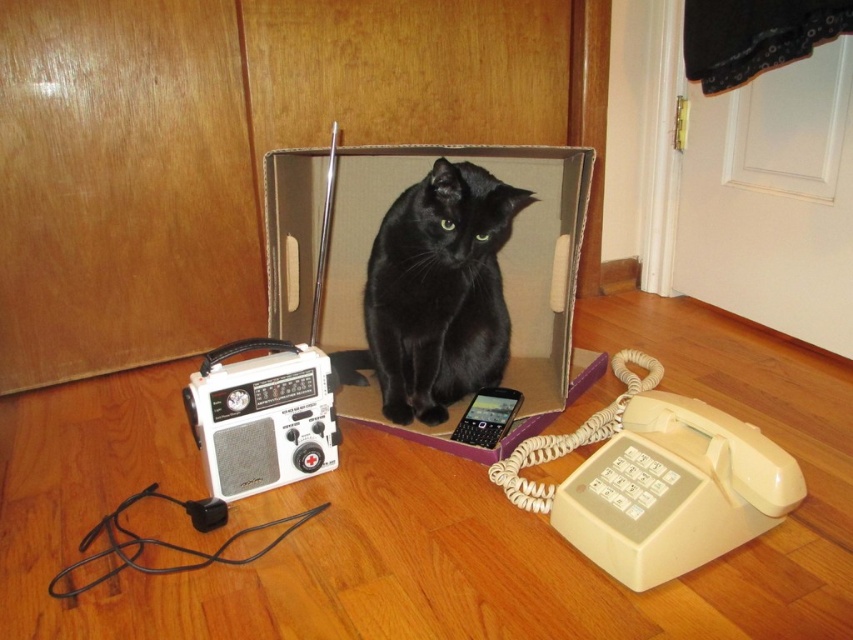
Does black glossy cat at center appear over black plastic phone at center?

Yes, black glossy cat at center is above black plastic phone at center.

Between black glossy cat at center and black plastic phone at center, which one is positioned higher?

black glossy cat at center is higher up.

Which is in front, point (374, 300) or point (479, 394)?

Positioned in front is point (374, 300).

The image size is (853, 640). I want to click on black glossy cat at center, so click(439, 291).

Based on the photo, who is shorter, cardboard box at center or white plastic radio at lower left?

white plastic radio at lower left is shorter.

You are a GUI agent. You are given a task and a screenshot of the screen. Output one action in this format:
    pyautogui.click(x=<x>, y=<y>)
    Task: Click on the cardboard box at center
    
    Given the screenshot: What is the action you would take?
    pyautogui.click(x=502, y=273)

Who is lower down, cardboard box at center or black glossy cat at center?

Positioned lower is black glossy cat at center.

Is cardboard box at center in front of black glossy cat at center?

Yes.

Which is in front, point (292, 211) or point (498, 355)?

Positioned in front is point (292, 211).

Find the location of a particular element. The width and height of the screenshot is (853, 640). cardboard box at center is located at coordinates (502, 273).